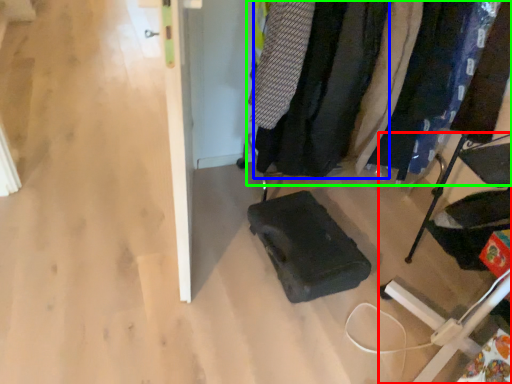
Question: Considering the real-world distances, which object is closest to furniture (highlighted by a red box)? clothing (highlighted by a blue box) or closet (highlighted by a green box).

Choices:
 (A) clothing
 (B) closet

Answer: (B)